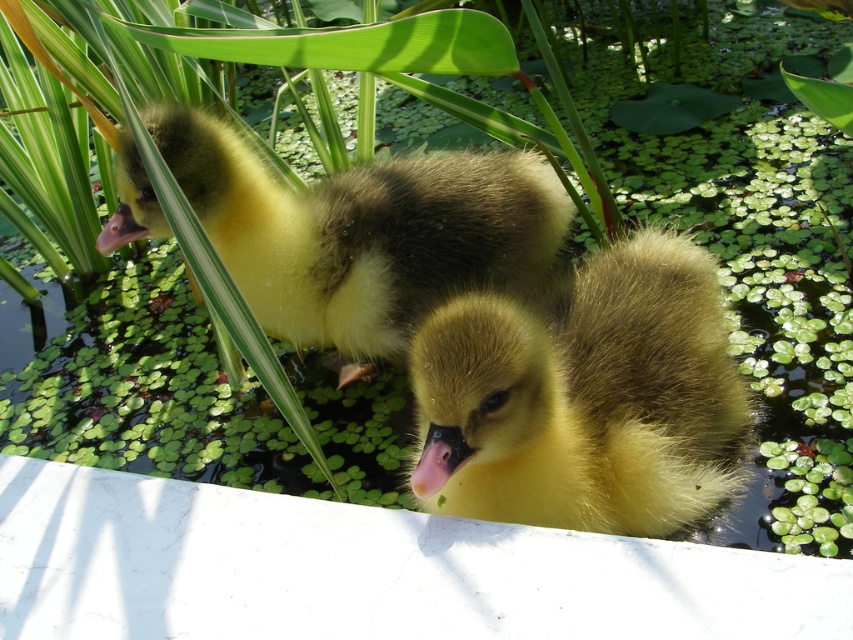
I want to click on yellow fluffy duckling at center, so click(584, 397).

Does yellow fluffy duckling at center have a larger size compared to yellow downy duckling at center?

Incorrect, yellow fluffy duckling at center is not larger than yellow downy duckling at center.

Which is behind, point (454, 490) or point (263, 212)?

Point (263, 212)

The width and height of the screenshot is (853, 640). I want to click on yellow fluffy duckling at center, so click(x=584, y=397).